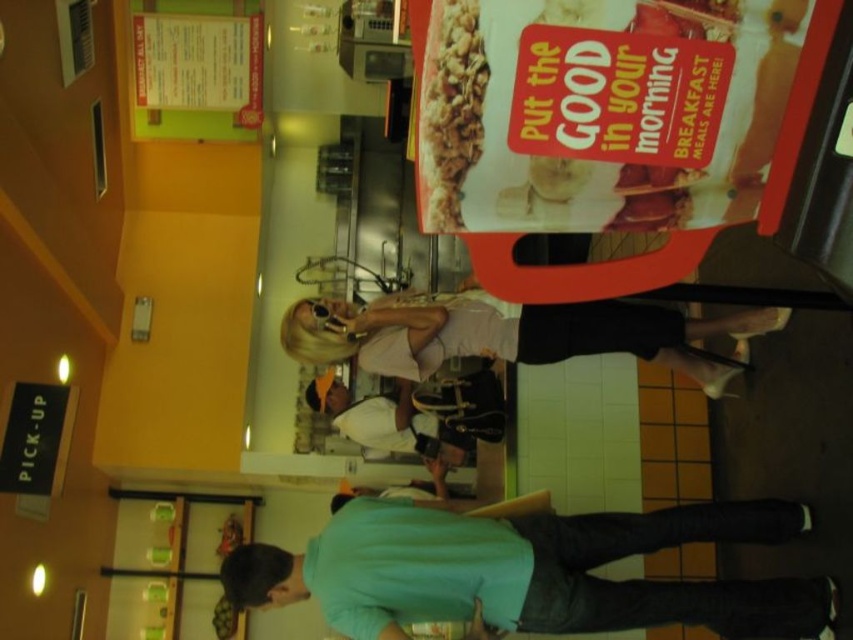
Question: From the image, what is the correct spatial relationship of matte cardboard poster at upper center in relation to crumbly granola bar at center?

Choices:
 (A) left
 (B) right

Answer: (B)

Question: Which object appears closest to the camera in this image?

Choices:
 (A) light beige fabric dress at center
 (B) teal matte shirt at lower center
 (C) crumbly granola bar at center

Answer: (C)

Question: Which is farther from the crumbly granola bar at center?

Choices:
 (A) matte cardboard poster at upper center
 (B) white fabric shirt at center

Answer: (B)

Question: Which point is closer to the camera?

Choices:
 (A) crumbly granola bar at center
 (B) matte cardboard poster at upper center

Answer: (A)

Question: Is light beige fabric dress at center below white fabric shirt at center?

Choices:
 (A) yes
 (B) no

Answer: (B)

Question: Is matte cardboard poster at upper center positioned at the back of teal matte shirt at lower center?

Choices:
 (A) no
 (B) yes

Answer: (A)